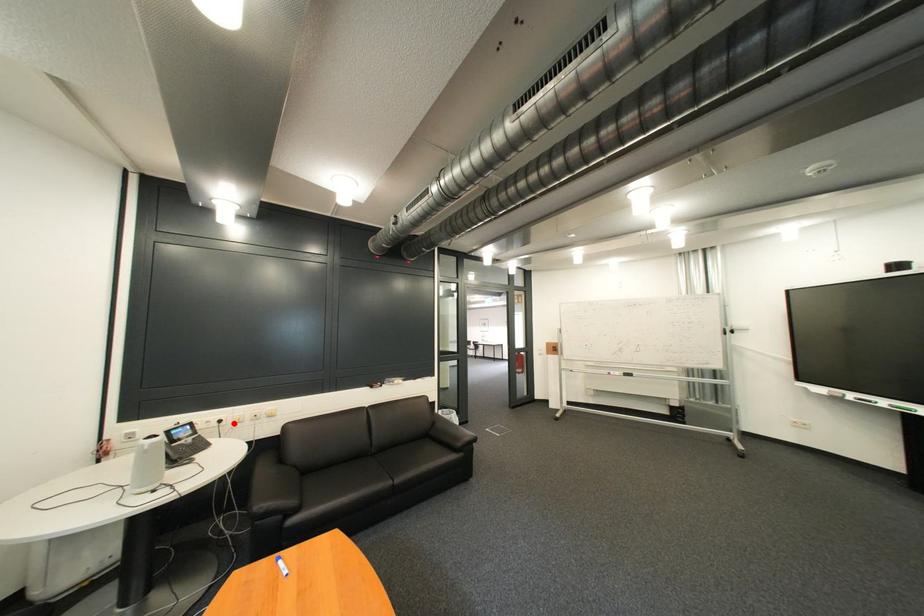
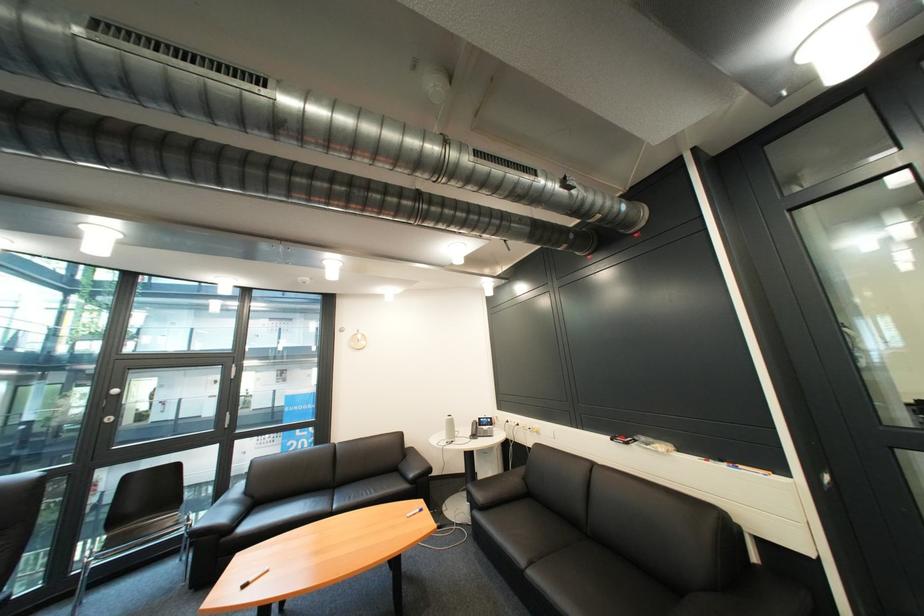
Question: I am providing you with two images of the same scene from different viewpoints. In image1, a red point is highlighted. Considering the same 3D point in image2, which of the following is correct?

Choices:
 (A) It is closer
 (B) It is farther

Answer: (B)